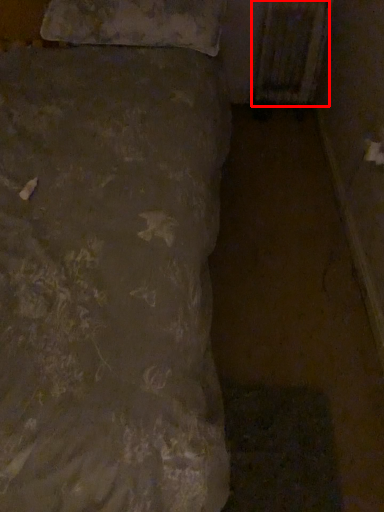
Question: From the image's perspective, what is the correct spatial positioning of radiator (annotated by the red box) in reference to pillow?

Choices:
 (A) below
 (B) above

Answer: (B)